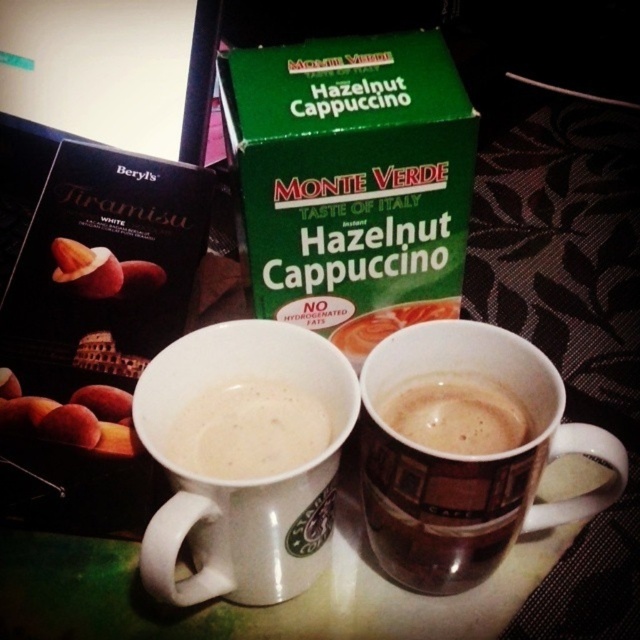
You are a barista trying to reach the green cardboard box at upper center to refill a drink. However, there is a white matte mug at center blocking your path. Can you easily access the box without moving the mug?

The green cardboard box at upper center is in front of the white matte mug at center, so it is not blocked by the mug. You can easily access the box without moving the mug.

You are a barista trying to place a new coffee cup between the brown ceramic mug at center and the brown matte cup at center. Can you fit it there without moving either existing cup?

The brown ceramic mug at center is in front of the brown matte cup at center, so there is no space between them to place a new coffee cup without moving either existing cup.